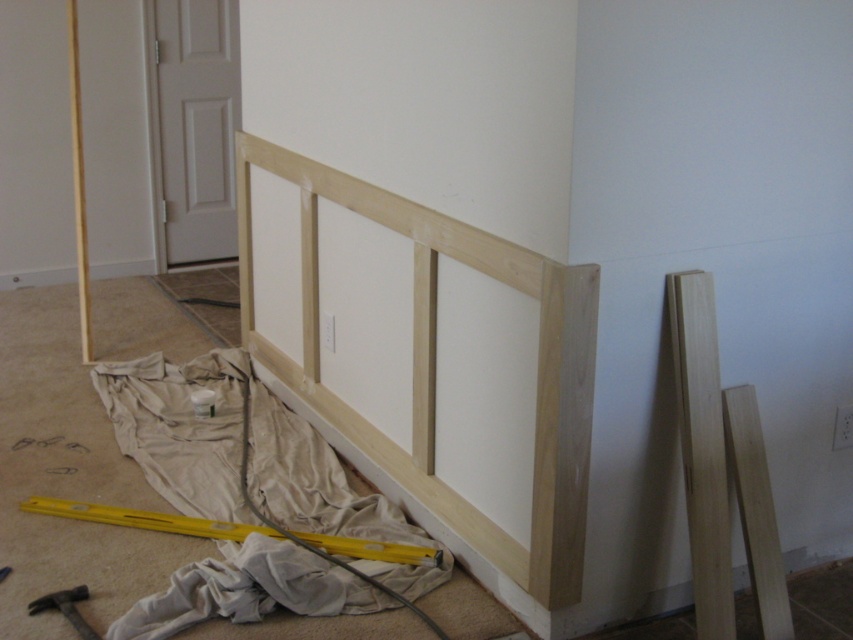
You are an interior designer planning to place a decorative item on the yellow wood beam at lower center. Given its position at coordinates 0.830, 0.274, can you confirm if this beam is positioned closer to the wall or the center of the room?

The yellow wood beam at lower center is located at point [233,531], which indicates it is closer to the wall than the center of the room.